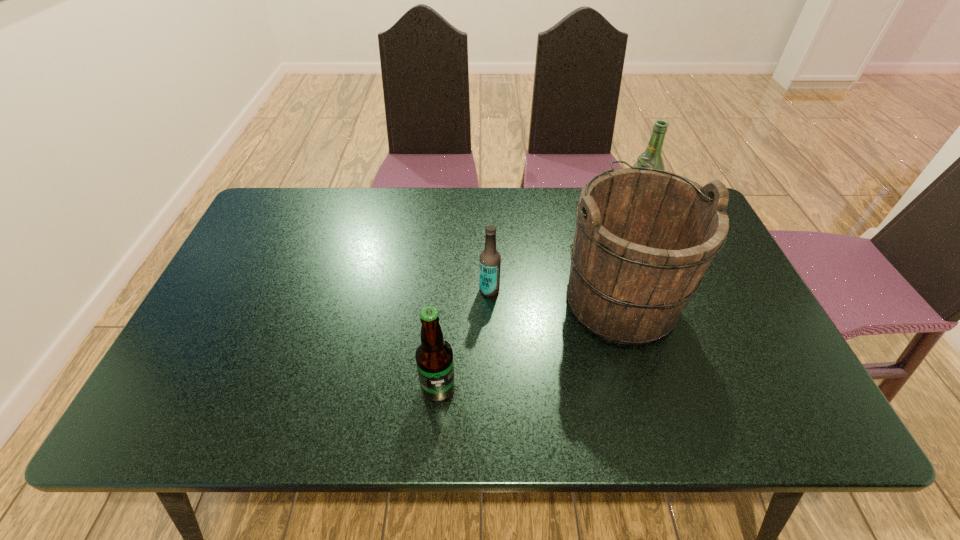
Image resolution: width=960 pixels, height=540 pixels. I want to click on the tallest object, so click(644, 237).

At what (x,y) coordinates should I click in order to perform the action: click on the rightmost beer bottle. Please return your answer as a coordinate pair (x, y). Looking at the image, I should click on (651, 158).

The height and width of the screenshot is (540, 960). In order to click on the farthest beer bottle in this screenshot , I will do `click(651, 158)`.

This screenshot has width=960, height=540. Identify the location of the nearest object. [x=434, y=355].

Where is `the nearest beer bottle`? the nearest beer bottle is located at coordinates (434, 355).

You are a GUI agent. You are given a task and a screenshot of the screen. Output one action in this format:
    pyautogui.click(x=<x>, y=<y>)
    Task: Click on the shortest object
    This screenshot has width=960, height=540.
    Given the screenshot: What is the action you would take?
    pyautogui.click(x=490, y=260)

Locate an element on the screen. the shortest beer bottle is located at coordinates (490, 260).

Find the location of `vacant region located 0.110m on the right of the tallest object`. vacant region located 0.110m on the right of the tallest object is located at coordinates (723, 298).

The image size is (960, 540). What are the coordinates of `vacant space located on the surface of the farthest beer bottle` in the screenshot? It's located at (501, 208).

Find the location of `blank area located 0.330m on the surface of the farthest beer bottle`. blank area located 0.330m on the surface of the farthest beer bottle is located at coordinates 516,208.